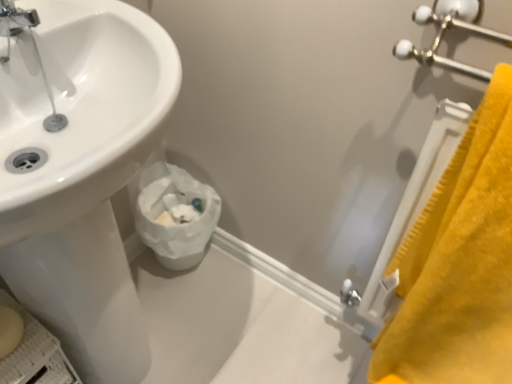
What is the approximate height of white paper at lower center?

10.54 inches.

Image resolution: width=512 pixels, height=384 pixels. Identify the location of white paper at lower center. (176, 224).

Would you consider yellow plush bath towel at right to be distant from white paper at lower center?

No, yellow plush bath towel at right is in close proximity to white paper at lower center.

From a real-world perspective, who is located lower, yellow plush bath towel at right or white paper at lower center?

white paper at lower center is physically lower.

How much distance is there between yellow plush bath towel at right and white paper at lower center?

25.98 inches.

Considering the relative positions of yellow plush bath towel at right and white paper at lower center in the image provided, is yellow plush bath towel at right to the left of white paper at lower center from the viewer's perspective?

In fact, yellow plush bath towel at right is to the right of white paper at lower center.

Which point is more distant from viewer, (5, 21) or (448, 243)?

The point (448, 243) is farther.

Would you say chrome metallic faucet at upper left is outside yellow plush bath towel at right?

chrome metallic faucet at upper left is positioned outside yellow plush bath towel at right.

Which object is positioned more to the left, chrome metallic faucet at upper left or yellow plush bath towel at right?

From the viewer's perspective, chrome metallic faucet at upper left appears more on the left side.

Are chrome metallic faucet at upper left and yellow plush bath towel at right far apart?

No, chrome metallic faucet at upper left is not far away from yellow plush bath towel at right.

In the scene shown: Is white paper at lower center at the left side of yellow plush bath towel at right?

Yes.

Considering the points (147, 239) and (451, 378), which point is in front, point (147, 239) or point (451, 378)?

Point (451, 378)

Can yellow plush bath towel at right be found inside white paper at lower center?

No, white paper at lower center does not contain yellow plush bath towel at right.

From the image's perspective, does white paper at lower center appear higher than yellow plush bath towel at right?

No, from the image's perspective, white paper at lower center is not over yellow plush bath towel at right.

From the image's perspective, which is above, chrome metallic faucet at upper left or white paper at lower center?

From the image's view, chrome metallic faucet at upper left is above.

Which is correct: chrome metallic faucet at upper left is inside white paper at lower center, or outside of it?

chrome metallic faucet at upper left lies outside white paper at lower center.

Does chrome metallic faucet at upper left have a smaller size compared to white paper at lower center?

Yes.

Relative to chrome metallic faucet at upper left, is yellow plush bath towel at right in front or behind?

Clearly, yellow plush bath towel at right is in front of chrome metallic faucet at upper left.

From the image's perspective, does yellow plush bath towel at right appear higher than chrome metallic faucet at upper left?

No, from the image's perspective, yellow plush bath towel at right is not above chrome metallic faucet at upper left.

Is chrome metallic faucet at upper left located within yellow plush bath towel at right?

No, chrome metallic faucet at upper left is not surrounded by yellow plush bath towel at right.

Does yellow plush bath towel at right have a greater width compared to chrome metallic faucet at upper left?

Indeed, yellow plush bath towel at right has a greater width compared to chrome metallic faucet at upper left.

From the picture: How many degrees apart are the facing directions of white paper at lower center and chrome metallic faucet at upper left?

white paper at lower center and chrome metallic faucet at upper left are facing 9.33 degrees away from each other.

Is white paper at lower center further to camera compared to chrome metallic faucet at upper left?

Yes, white paper at lower center is behind chrome metallic faucet at upper left.

Considering the sizes of objects white paper at lower center and chrome metallic faucet at upper left in the image provided, who is thinner, white paper at lower center or chrome metallic faucet at upper left?

chrome metallic faucet at upper left is thinner.

From the image's perspective, does white paper at lower center appear lower than chrome metallic faucet at upper left?

Correct, white paper at lower center appears lower than chrome metallic faucet at upper left in the image.

Locate an element on the screen. This screenshot has width=512, height=384. bath towel that appears above the white paper at lower center (from the image's perspective) is located at coordinates (459, 264).

Where is `tap behind the yellow plush bath towel at right`? The width and height of the screenshot is (512, 384). tap behind the yellow plush bath towel at right is located at coordinates (15, 18).

When comparing their distances from white paper at lower center, does chrome metallic faucet at upper left or yellow plush bath towel at right seem closer?

yellow plush bath towel at right is positioned closer to the anchor white paper at lower center.

Which object lies further to the anchor point yellow plush bath towel at right, white paper at lower center or chrome metallic faucet at upper left?

chrome metallic faucet at upper left.

Considering their positions, is yellow plush bath towel at right positioned closer to white paper at lower center than chrome metallic faucet at upper left?

yellow plush bath towel at right is positioned closer to the anchor white paper at lower center.

Estimate the real-world distances between objects in this image. Which object is further from chrome metallic faucet at upper left, white paper at lower center or yellow plush bath towel at right?

yellow plush bath towel at right.

When comparing their distances from chrome metallic faucet at upper left, does yellow plush bath towel at right or white paper at lower center seem closer?

The object closer to chrome metallic faucet at upper left is white paper at lower center.

Based on their spatial positions, is chrome metallic faucet at upper left or white paper at lower center further from yellow plush bath towel at right?

The object further to yellow plush bath towel at right is chrome metallic faucet at upper left.

The height and width of the screenshot is (384, 512). What are the coordinates of `toilet paper located between chrome metallic faucet at upper left and yellow plush bath towel at right in the left-right direction` in the screenshot? It's located at (176, 224).